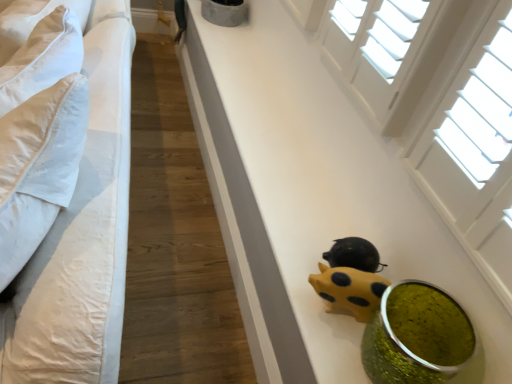
At what (x,y) coordinates should I click in order to perform the action: click on blank space situated above yellow matte piggy bank at lower center (from a real-world perspective). Please return your answer as a coordinate pair (x, y). The height and width of the screenshot is (384, 512). Looking at the image, I should click on (266, 114).